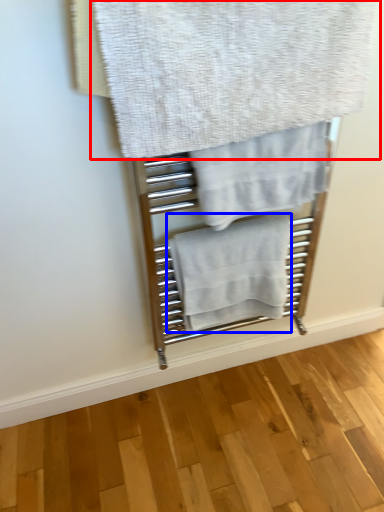
Question: Which object appears farthest to the camera in this image, towel (highlighted by a red box) or towel (highlighted by a blue box)?

Choices:
 (A) towel
 (B) towel

Answer: (B)